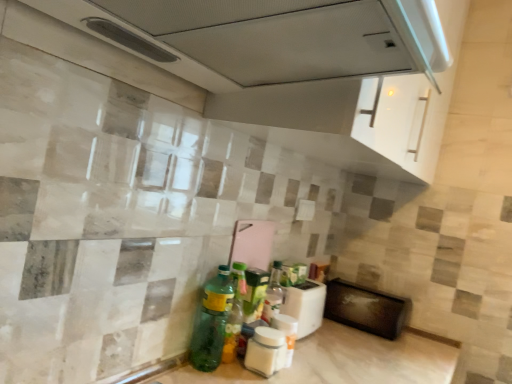
Question: Is black matte microwave at lower right, which ranks as the second appliance in left-to-right order, located within white matte jar at center, the 2th bottle from the right?

Choices:
 (A) yes
 (B) no

Answer: (B)

Question: Is white matte jar at center, the 2th bottle from the right, looking in the opposite direction of black matte microwave at lower right, which ranks as the second appliance in left-to-right order?

Choices:
 (A) yes
 (B) no

Answer: (B)

Question: From a real-world perspective, does white matte jar at center, the 2th bottle from the right, stand above black matte microwave at lower right, the 1th appliance positioned from the back?

Choices:
 (A) yes
 (B) no

Answer: (B)

Question: Is the position of white matte jar at center, the 2th bottle from the right, more distant than that of black matte microwave at lower right, which ranks as the second appliance in left-to-right order?

Choices:
 (A) no
 (B) yes

Answer: (A)

Question: Is white matte jar at center, the 2th bottle from the right, at the left side of black matte microwave at lower right, the 1th appliance positioned from the back?

Choices:
 (A) yes
 (B) no

Answer: (A)

Question: From a real-world perspective, is green glass bottle at lower center, the 1th bottle positioned from the left, positioned above or below white plastic toaster at lower center, the second appliance in the right-to-left sequence?

Choices:
 (A) below
 (B) above

Answer: (B)

Question: In the image, is green glass bottle at lower center, the 1th bottle positioned from the left, positioned in front of or behind white plastic toaster at lower center, the second appliance in the right-to-left sequence?

Choices:
 (A) behind
 (B) front

Answer: (B)

Question: In terms of height, does green glass bottle at lower center, the 1th bottle positioned from the left, look taller or shorter compared to white plastic toaster at lower center, the second appliance in the right-to-left sequence?

Choices:
 (A) short
 (B) tall

Answer: (B)

Question: Considering the positions of green glass bottle at lower center, which is the 3th bottle in right-to-left order, and white plastic toaster at lower center, the 2th appliance from the back, in the image, is green glass bottle at lower center, which is the 3th bottle in right-to-left order, wider or thinner than white plastic toaster at lower center, the 2th appliance from the back,?

Choices:
 (A) wide
 (B) thin

Answer: (B)

Question: In terms of size, does white plastic toaster at lower center, the 1th appliance viewed from the front, appear bigger or smaller than white glossy exhaust hood at upper center?

Choices:
 (A) small
 (B) big

Answer: (A)

Question: Considering the positions of point (297, 314) and point (439, 31), is point (297, 314) closer or farther from the camera than point (439, 31)?

Choices:
 (A) farther
 (B) closer

Answer: (A)

Question: From a real-world perspective, relative to white glossy exhaust hood at upper center, is white plastic toaster at lower center, the second appliance in the right-to-left sequence, vertically above or below?

Choices:
 (A) below
 (B) above

Answer: (A)

Question: Is white plastic toaster at lower center, the second appliance in the right-to-left sequence, inside the boundaries of white glossy exhaust hood at upper center, or outside?

Choices:
 (A) outside
 (B) inside

Answer: (A)

Question: From the image's perspective, is black matte microwave at lower right, which ranks as the first appliance in right-to-left order, above or below white matte jar at center, the 2th bottle from the right?

Choices:
 (A) below
 (B) above

Answer: (A)

Question: Does point (368, 294) appear closer or farther from the camera than point (264, 327)?

Choices:
 (A) farther
 (B) closer

Answer: (A)